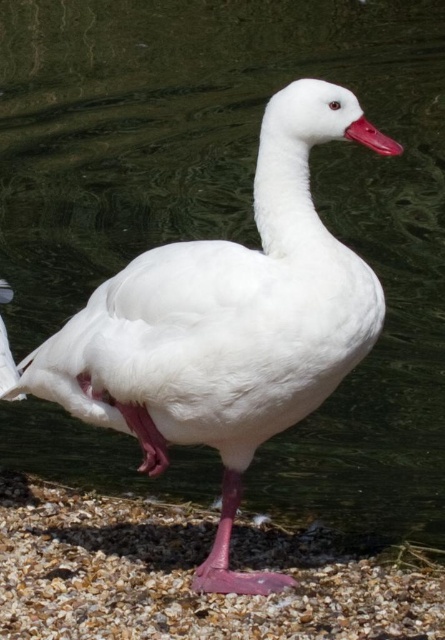
Question: Does white feathered duck at center have a greater width compared to smooth gravel at lower center?

Choices:
 (A) no
 (B) yes

Answer: (A)

Question: Which point appears closest to the camera in this image?

Choices:
 (A) (144, 584)
 (B) (343, 275)
 (C) (379, 152)

Answer: (B)

Question: Is smooth gravel at lower center in front of matte pink beak at center?

Choices:
 (A) no
 (B) yes

Answer: (A)

Question: Based on their relative distances, which object is farther from the matte pink beak at center?

Choices:
 (A) white feathered duck at center
 (B) smooth gravel at lower center

Answer: (B)

Question: Can you confirm if white feathered duck at center is thinner than smooth gravel at lower center?

Choices:
 (A) yes
 (B) no

Answer: (A)

Question: Which point is farther to the camera?

Choices:
 (A) matte pink beak at center
 (B) smooth gravel at lower center
 (C) white feathered duck at center

Answer: (B)